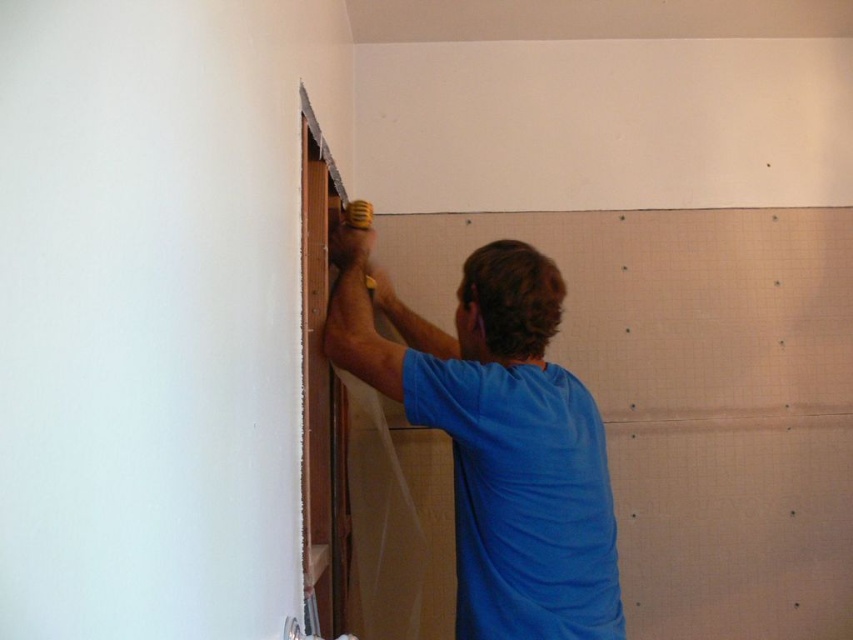
Question: Does blue fabric shirt at center appear on the right side of yellow rubber drill at upper center?

Choices:
 (A) no
 (B) yes

Answer: (B)

Question: Is blue fabric shirt at center above yellow rubber drill at upper center?

Choices:
 (A) no
 (B) yes

Answer: (A)

Question: Which object appears farthest from the camera in this image?

Choices:
 (A) yellow rubber drill at upper center
 (B) blue fabric shirt at center

Answer: (A)

Question: Which point is closer to the camera?

Choices:
 (A) yellow rubber drill at upper center
 (B) blue fabric shirt at center

Answer: (B)

Question: Can you confirm if blue fabric shirt at center is bigger than yellow rubber drill at upper center?

Choices:
 (A) yes
 (B) no

Answer: (A)